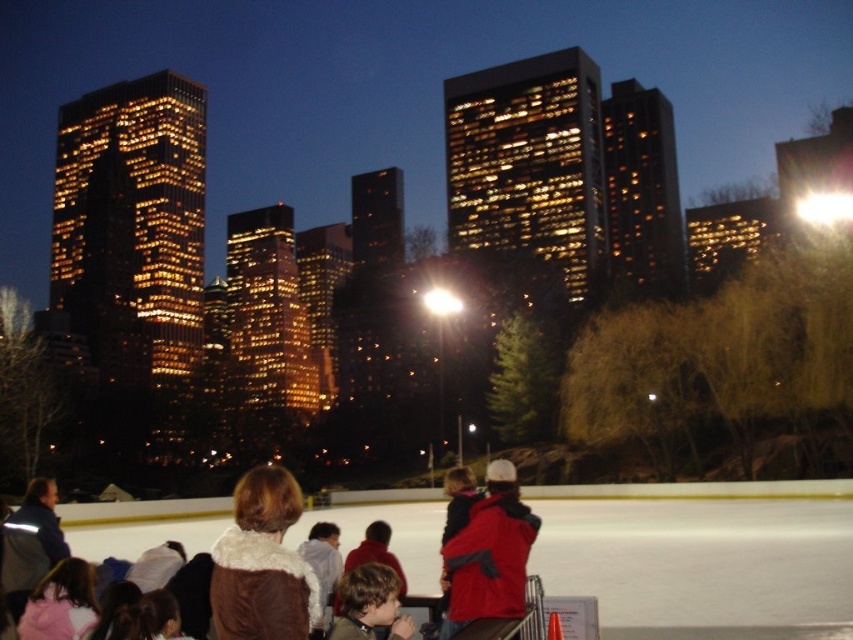
Which is below, brown fur coat at center or brown fuzzy jacket at lower center?

brown fur coat at center

Is brown fur coat at center to the left of brown fuzzy jacket at lower center from the viewer's perspective?

Yes, brown fur coat at center is to the left of brown fuzzy jacket at lower center.

Does point (254, 630) lie in front of point (387, 579)?

That is True.

Where is `brown fur coat at center`? The width and height of the screenshot is (853, 640). brown fur coat at center is located at coordinates (262, 564).

From the picture: Which of these two, brown fur coat at center or red matte jacket at center, stands shorter?

Standing shorter between the two is red matte jacket at center.

Between brown fur coat at center and red matte jacket at center, which one is positioned lower?

brown fur coat at center is below.

Between point (302, 573) and point (442, 547), which one is positioned behind?

Positioned behind is point (442, 547).

Where is `brown fur coat at center`? This screenshot has width=853, height=640. brown fur coat at center is located at coordinates (262, 564).

Who is more forward, (519, 605) or (367, 621)?

Point (367, 621) is more forward.

Can you confirm if red matte jacket at center is taller than brown fuzzy jacket at lower center?

Indeed, red matte jacket at center has a greater height compared to brown fuzzy jacket at lower center.

This screenshot has height=640, width=853. I want to click on red matte jacket at center, so click(x=488, y=554).

This screenshot has height=640, width=853. I want to click on red matte jacket at center, so click(x=488, y=554).